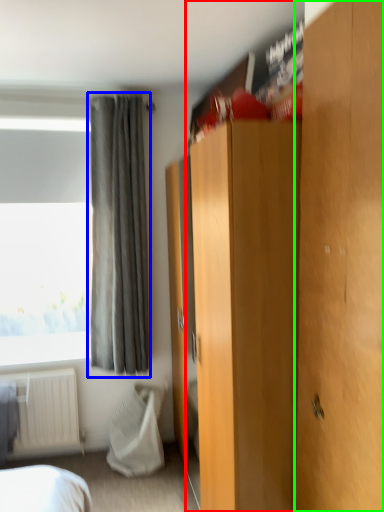
Question: Which object is positioned closest to dresser (highlighted by a red box)? Select from curtain (highlighted by a blue box) and door (highlighted by a green box).

Choices:
 (A) curtain
 (B) door

Answer: (B)